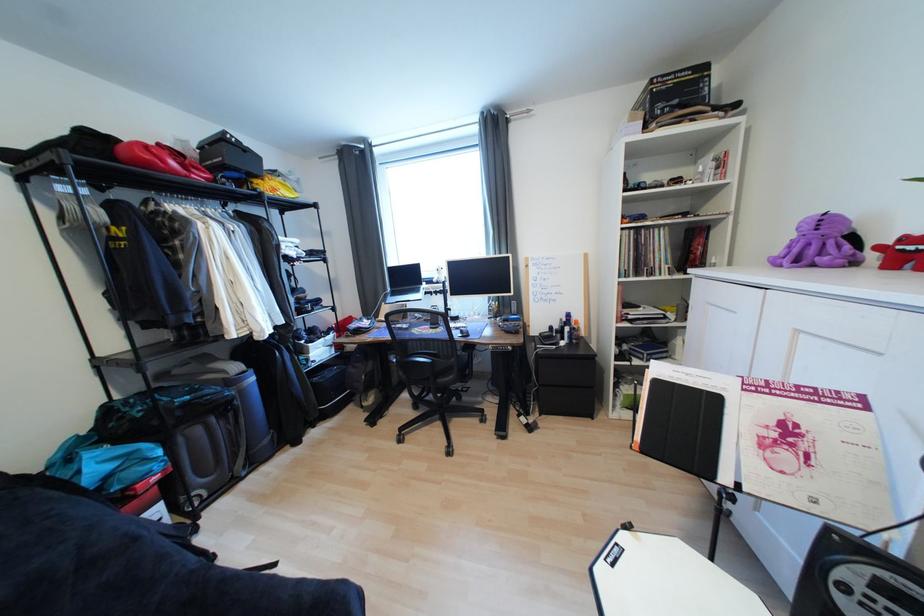
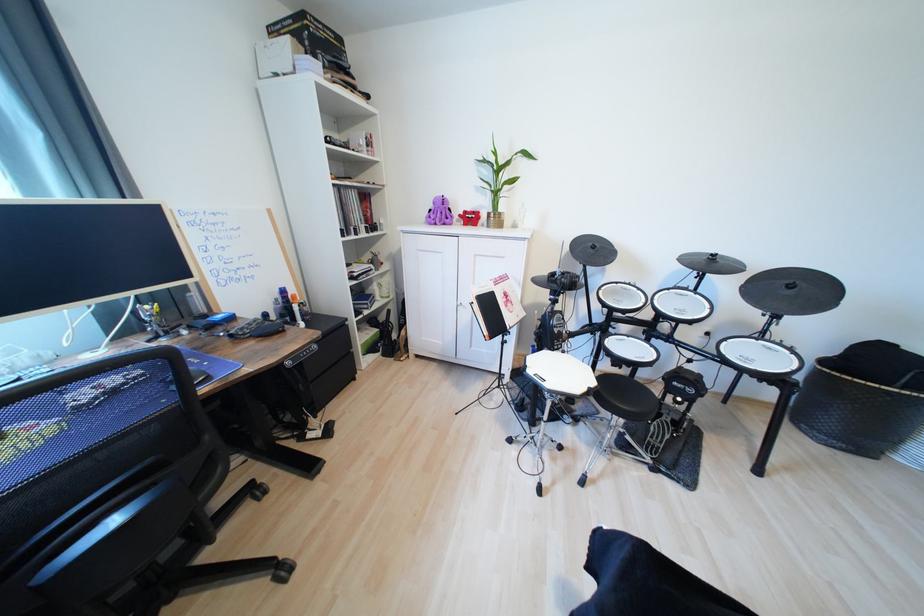
The point at (833, 248) is marked in the first image. Where is the corresponding point in the second image?

(447, 216)